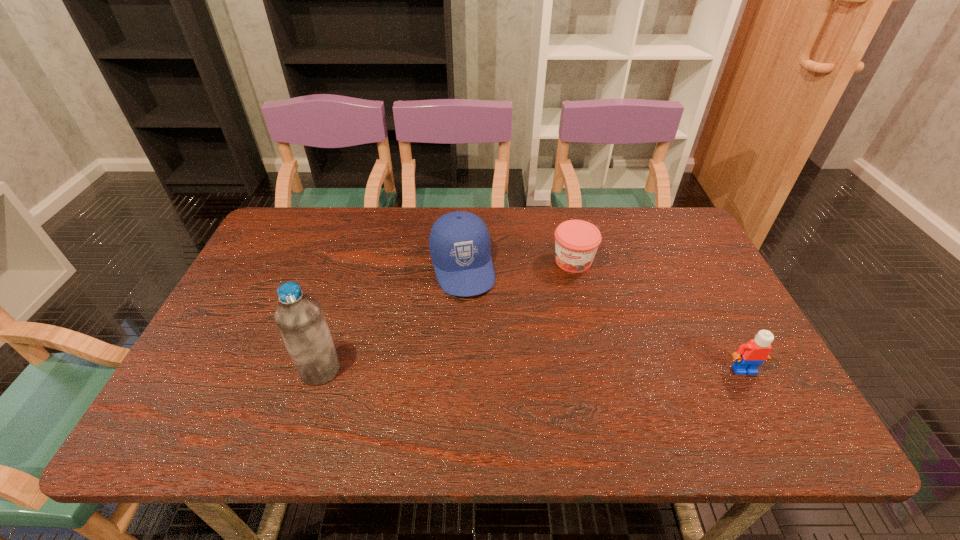
Locate an element on the screen. This screenshot has width=960, height=540. vacant region at the far edge of the desktop is located at coordinates (359, 215).

The width and height of the screenshot is (960, 540). I want to click on free region at the near edge of the desktop, so click(660, 389).

In the image, there is a desktop. Where is `vacant region at the right edge`? This screenshot has width=960, height=540. vacant region at the right edge is located at coordinates (730, 310).

Find the location of a particular element. The image size is (960, 540). vacant space at the far left corner of the desktop is located at coordinates (287, 219).

The height and width of the screenshot is (540, 960). I want to click on blank space at the near left corner, so click(x=230, y=388).

You are a GUI agent. You are given a task and a screenshot of the screen. Output one action in this format:
    pyautogui.click(x=<x>, y=<y>)
    Task: Click on the vacant space at the far right corner
    Image resolution: width=960 pixels, height=540 pixels.
    Given the screenshot: What is the action you would take?
    pyautogui.click(x=671, y=227)

Find the location of `unoccupied area between the second object from right to left and the third object from right to left`. unoccupied area between the second object from right to left and the third object from right to left is located at coordinates (517, 265).

Find the location of a particular element. This screenshot has width=960, height=540. vacant point located between the third object from right to left and the tallest object is located at coordinates click(x=392, y=319).

The width and height of the screenshot is (960, 540). Identify the location of vacant region between the rightmost object and the second object from right to left. (659, 315).

The width and height of the screenshot is (960, 540). Find the location of `free spot between the cap and the rightmost object`. free spot between the cap and the rightmost object is located at coordinates 603,319.